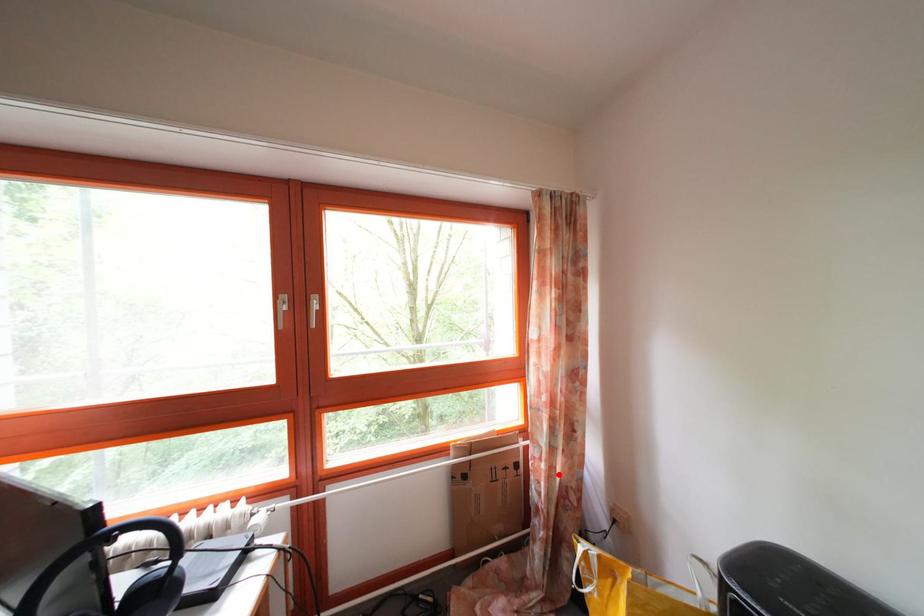
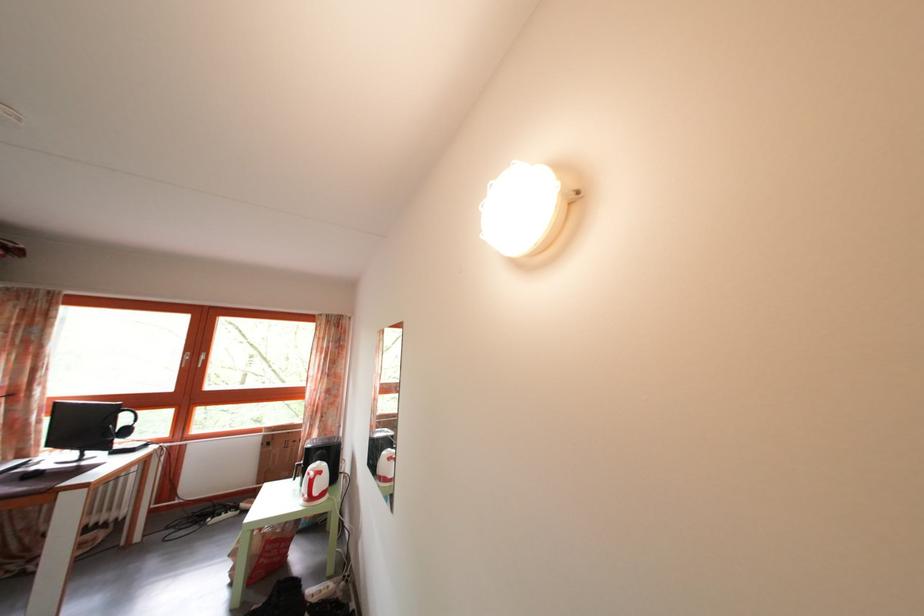
The point at the highlighted location is marked in the first image. Where is the corresponding point in the second image?

(317, 442)